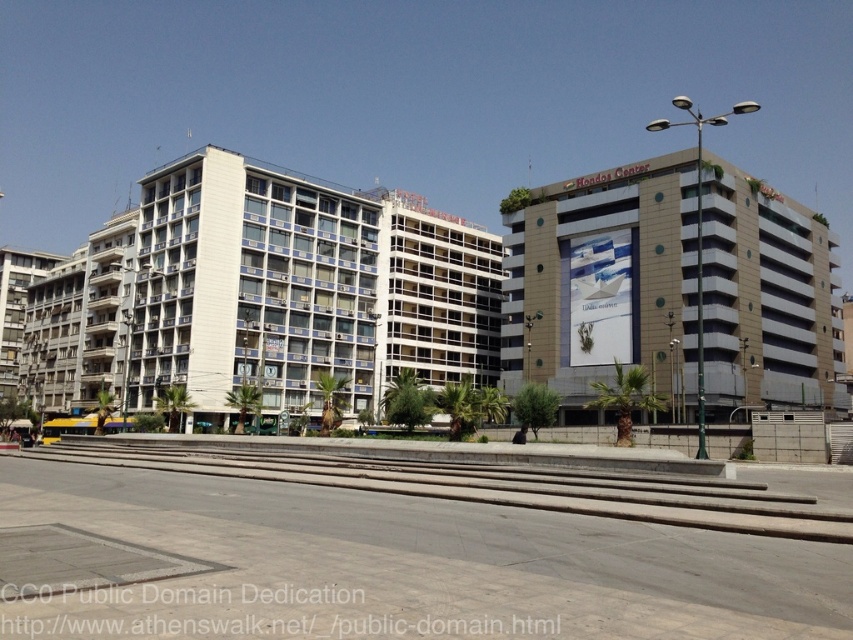
From the picture: Does beige concrete building at upper right lie in front of gray concrete train track at lower center?

No, beige concrete building at upper right is behind gray concrete train track at lower center.

Can you confirm if beige concrete building at upper right is smaller than gray concrete train track at lower center?

No.

Describe the element at coordinates (602, 282) in the screenshot. This screenshot has height=640, width=853. I see `beige concrete building at upper right` at that location.

Identify the location of beige concrete building at upper right. (602, 282).

Does white concrete building at center have a greater height compared to gray concrete train track at lower center?

Correct, white concrete building at center is much taller as gray concrete train track at lower center.

At what (x,y) coordinates should I click in order to perform the action: click on white concrete building at center. Please return your answer as a coordinate pair (x, y). The image size is (853, 640). Looking at the image, I should click on (264, 294).

At what (x,y) coordinates should I click in order to perform the action: click on white concrete building at center. Please return your answer as a coordinate pair (x, y). This screenshot has height=640, width=853. Looking at the image, I should click on (264, 294).

Can you confirm if white concrete building at center is positioned to the right of beige concrete building at upper right?

No, white concrete building at center is not to the right of beige concrete building at upper right.

How distant is white concrete building at center from beige concrete building at upper right?

148.14 feet

Find the location of `white concrete building at center`. white concrete building at center is located at coordinates (264, 294).